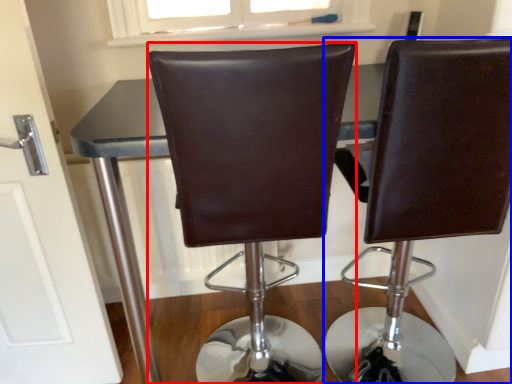
Question: Among these objects, which one is farthest to the camera, chair (highlighted by a red box) or chair (highlighted by a blue box)?

Choices:
 (A) chair
 (B) chair

Answer: (B)